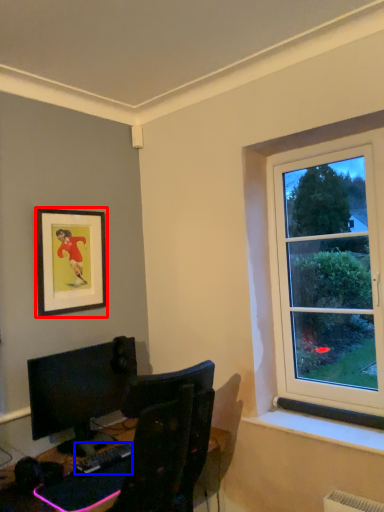
Question: Which of the following is the farthest to the observer, picture frame (highlighted by a red box) or computer keyboard (highlighted by a blue box)?

Choices:
 (A) picture frame
 (B) computer keyboard

Answer: (A)